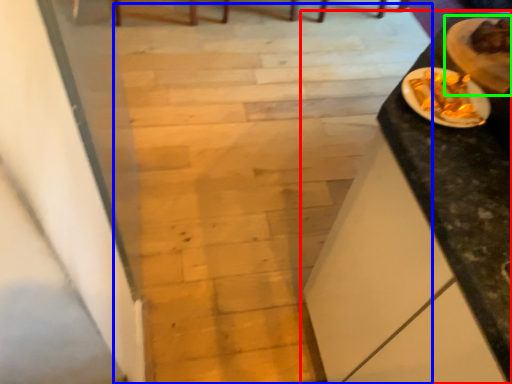
Question: Which object is the closest to the table (highlighted by a red box)? Choose among these: stairwell (highlighted by a blue box) or food (highlighted by a green box).

Choices:
 (A) stairwell
 (B) food

Answer: (B)